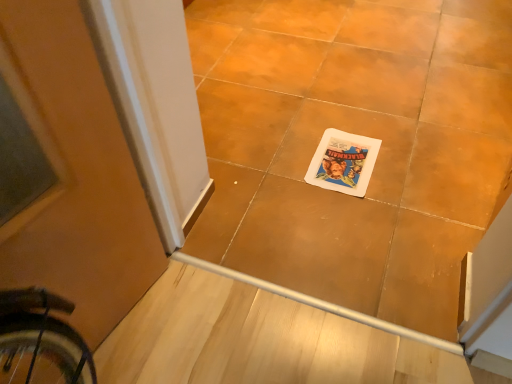
At what (x,y) coordinates should I click in order to perform the action: click on blank space above white matte comic book at center (from a real-world perspective). Please return your answer as a coordinate pair (x, y). Looking at the image, I should click on (345, 155).